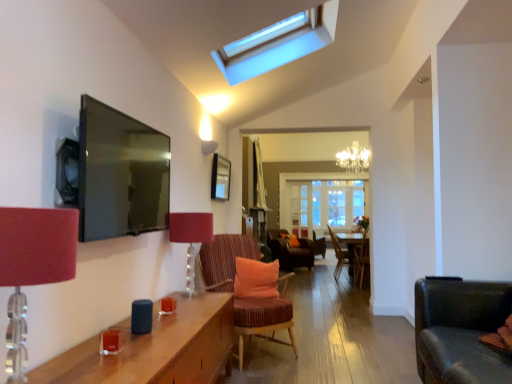
Question: From a real-world perspective, does wooden picture frame at center sit lower than wooden chair at center, acting as the 2th chair starting from the back?

Choices:
 (A) no
 (B) yes

Answer: (A)

Question: Does wooden picture frame at center have a lesser width compared to wooden chair at center, which is the 3th chair in front-to-back order?

Choices:
 (A) yes
 (B) no

Answer: (A)

Question: Would you consider wooden picture frame at center to be distant from wooden chair at center, which is the 3th chair in front-to-back order?

Choices:
 (A) yes
 (B) no

Answer: (A)

Question: From the image's perspective, is wooden picture frame at center located beneath wooden chair at center, acting as the 2th chair starting from the back?

Choices:
 (A) no
 (B) yes

Answer: (A)

Question: Is the position of wooden picture frame at center more distant than that of wooden chair at center, which is the 3th chair in front-to-back order?

Choices:
 (A) yes
 (B) no

Answer: (B)

Question: Does wooden picture frame at center touch wooden chair at center, which is the 3th chair in front-to-back order?

Choices:
 (A) yes
 (B) no

Answer: (B)

Question: Considering the relative sizes of wooden chair at center, the second chair in the front-to-back sequence, and transparent glass skylight at upper center in the image provided, is wooden chair at center, the second chair in the front-to-back sequence, taller than transparent glass skylight at upper center?

Choices:
 (A) no
 (B) yes

Answer: (B)

Question: From the image's perspective, is wooden chair at center, the second chair in the front-to-back sequence, under transparent glass skylight at upper center?

Choices:
 (A) no
 (B) yes

Answer: (B)

Question: Is wooden chair at center, the second chair in the front-to-back sequence, far away from transparent glass skylight at upper center?

Choices:
 (A) no
 (B) yes

Answer: (B)

Question: Is wooden chair at center, the second chair in the front-to-back sequence, shorter than transparent glass skylight at upper center?

Choices:
 (A) yes
 (B) no

Answer: (B)

Question: Does wooden chair at center, acting as the third chair starting from the back, have a smaller size compared to transparent glass skylight at upper center?

Choices:
 (A) no
 (B) yes

Answer: (B)

Question: Is wooden chair at center, acting as the third chair starting from the back, next to transparent glass skylight at upper center and touching it?

Choices:
 (A) no
 (B) yes

Answer: (A)

Question: Considering the relative positions of wooden picture frame at center and wooden chair at center, the second chair in the front-to-back sequence, in the image provided, is wooden picture frame at center behind wooden chair at center, the second chair in the front-to-back sequence,?

Choices:
 (A) no
 (B) yes

Answer: (A)